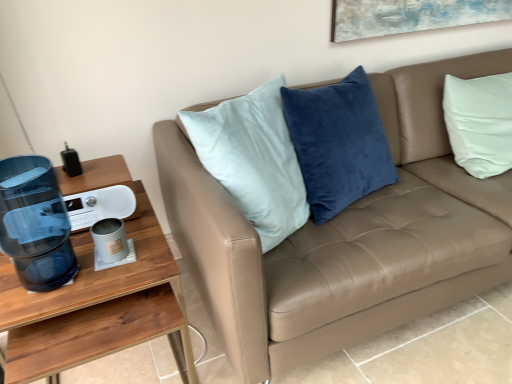
Where is `vacant area that is in front of matte gray mug at lower left`? The width and height of the screenshot is (512, 384). vacant area that is in front of matte gray mug at lower left is located at coordinates (88, 283).